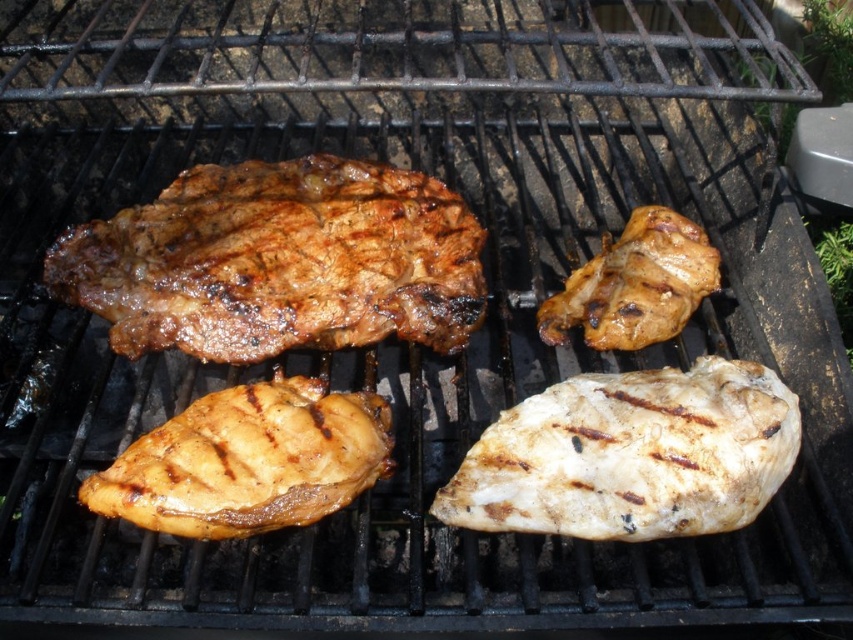
Is golden-brown glazed chicken breast at lower left to the right of brown matte chicken at upper right from the viewer's perspective?

Incorrect, golden-brown glazed chicken breast at lower left is not on the right side of brown matte chicken at upper right.

Is point (119, 458) closer to camera compared to point (708, 259)?

Yes, it is.

The width and height of the screenshot is (853, 640). Describe the element at coordinates (248, 460) in the screenshot. I see `golden-brown glazed chicken breast at lower left` at that location.

The height and width of the screenshot is (640, 853). Find the location of `golden-brown glazed chicken breast at lower left`. golden-brown glazed chicken breast at lower left is located at coordinates (248, 460).

Is white matte chicken breast at center behind golden-brown glazed chicken breast at lower left?

No, white matte chicken breast at center is closer to the viewer.

Who is lower down, white matte chicken breast at center or golden-brown glazed chicken breast at lower left?

Positioned lower is golden-brown glazed chicken breast at lower left.

I want to click on white matte chicken breast at center, so click(631, 456).

Is point (335, 156) positioned behind point (712, 476)?

Yes.

Is grilled brown steak at upper left positioned in front of white matte chicken breast at center?

No, it is not.

The height and width of the screenshot is (640, 853). Describe the element at coordinates (279, 260) in the screenshot. I see `grilled brown steak at upper left` at that location.

Find the location of a particular element. The width and height of the screenshot is (853, 640). grilled brown steak at upper left is located at coordinates (279, 260).